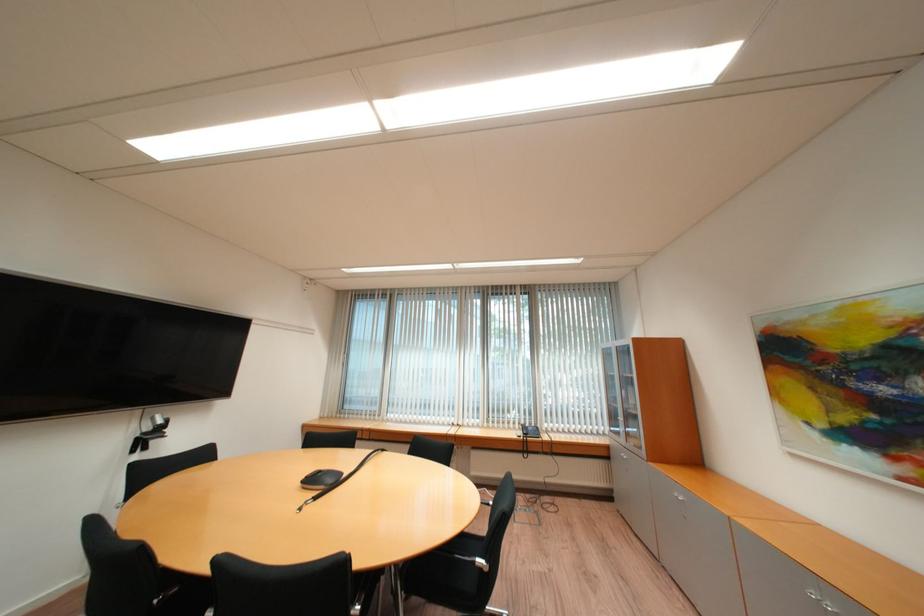
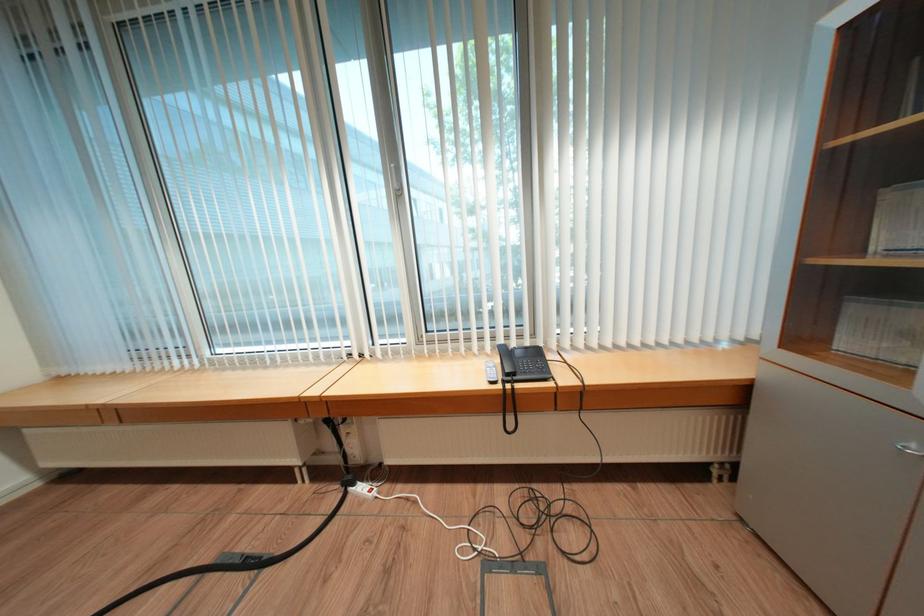
Question: In a continuous first-person perspective shot, in which direction is the camera moving?

Choices:
 (A) Left
 (B) Right
 (C) Forward
 (D) Backward

Answer: (C)